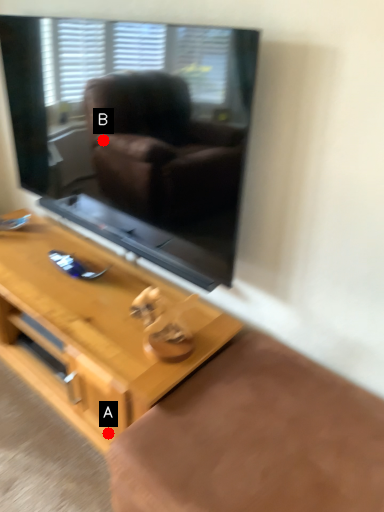
Question: Two points are circled on the image, labeled by A and B beside each circle. Which point appears closest to the camera in this image?

Choices:
 (A) A is closer
 (B) B is closer

Answer: (A)